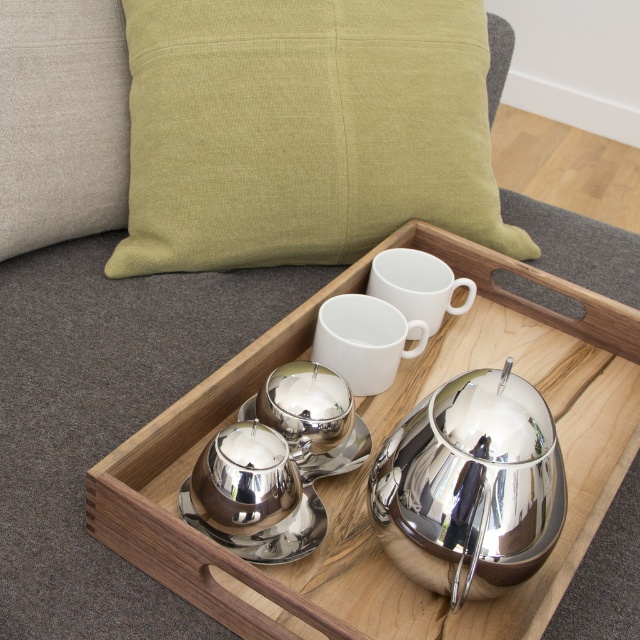
The image size is (640, 640). What do you see at coordinates (378, 449) in the screenshot?
I see `polished silver tray at center` at bounding box center [378, 449].

Can you confirm if polished silver tray at center is wider than white glossy mug at center?

Yes.

Locate an element on the screen. polished silver tray at center is located at coordinates (378, 449).

Where is `polished silver tray at center`? polished silver tray at center is located at coordinates (378, 449).

Is point (339, 307) positioned in front of point (458, 284)?

That is True.

Is white glossy mug at center smaller than white matte cup at center?

Yes.

Image resolution: width=640 pixels, height=640 pixels. In order to click on white glossy mug at center in this screenshot , I will do `click(364, 340)`.

Locate an element on the screen. This screenshot has height=640, width=640. white glossy mug at center is located at coordinates (364, 340).

Which is below, green fabric cushion at upper center or white matte cup at center?

Positioned lower is white matte cup at center.

Between point (244, 104) and point (406, 289), which one is positioned behind?

The point (406, 289) is behind.

Is point (257, 216) behind point (436, 276)?

Yes, point (257, 216) is farther from viewer.

Identify the location of green fabric cushion at upper center. (304, 131).